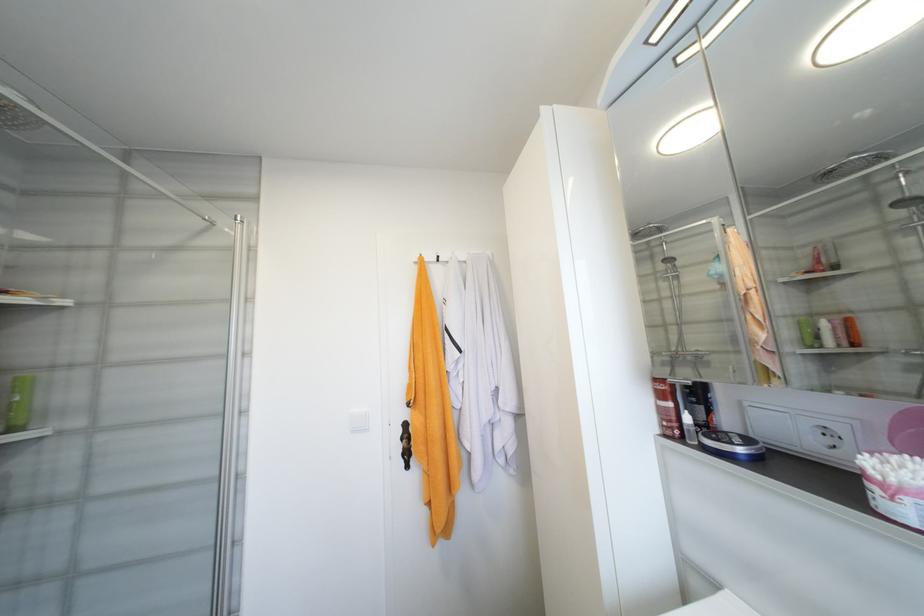
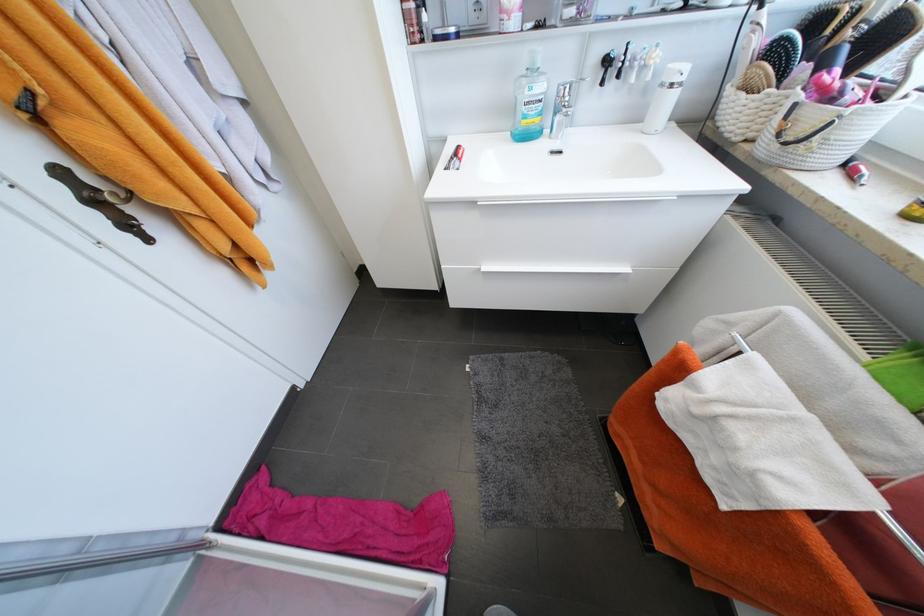
The point at (412, 456) is marked in the first image. Where is the corresponding point in the second image?

(132, 225)